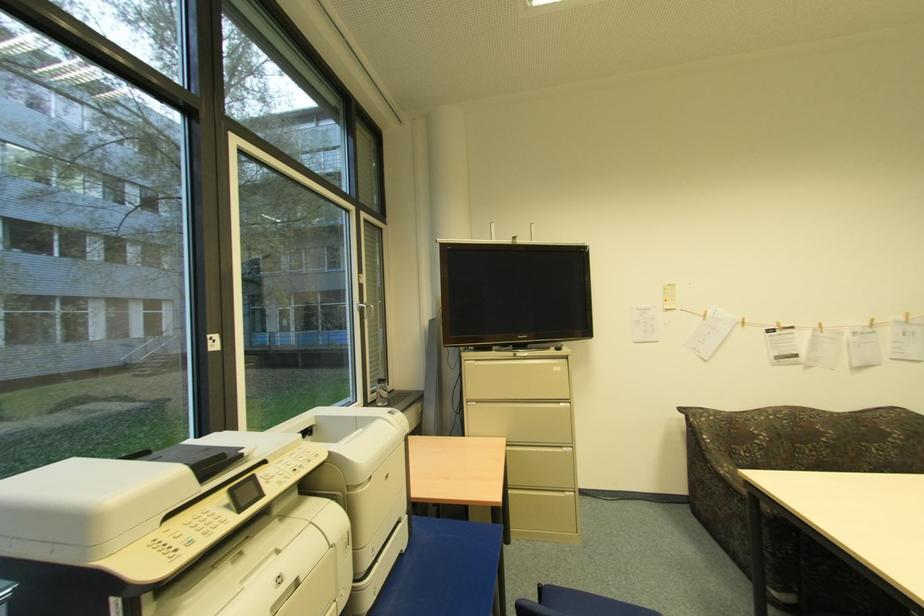
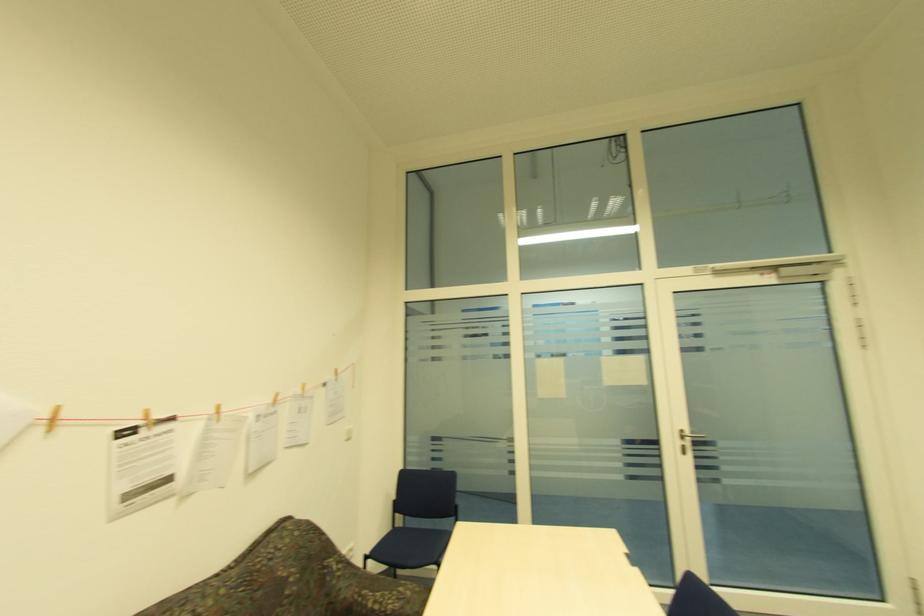
The point at [822,328] is marked in the first image. Where is the corresponding point in the second image?

(219, 413)